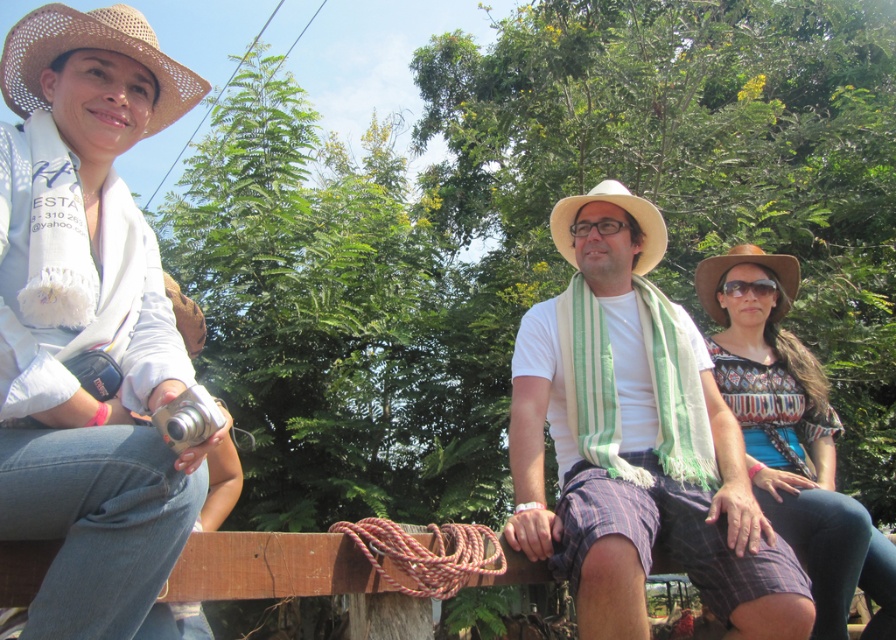
Is patterned fabric shirt at center taller than strawhat at upper left?

Correct, patterned fabric shirt at center is much taller as strawhat at upper left.

Does patterned fabric shirt at center appear over strawhat at upper left?

No.

Identify the location of patterned fabric shirt at center. Image resolution: width=896 pixels, height=640 pixels. (793, 440).

Does white straw hat at center have a greater width compared to brown straw hat at right?

In fact, white straw hat at center might be narrower than brown straw hat at right.

Identify the location of white straw hat at center. (622, 209).

Image resolution: width=896 pixels, height=640 pixels. I want to click on white straw hat at center, so click(x=622, y=209).

Is white woven hat at upper left bigger than brown straw hat at right?

Yes.

Who is lower down, white woven hat at upper left or brown straw hat at right?

white woven hat at upper left is below.

The height and width of the screenshot is (640, 896). What do you see at coordinates (88, 320) in the screenshot?
I see `white woven hat at upper left` at bounding box center [88, 320].

The width and height of the screenshot is (896, 640). What are the coordinates of `white woven hat at upper left` in the screenshot? It's located at (88, 320).